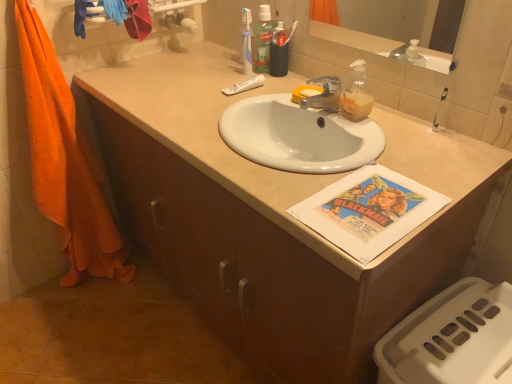
Where is `unoccupied area in front of white matte tube at center`? unoccupied area in front of white matte tube at center is located at coordinates (225, 108).